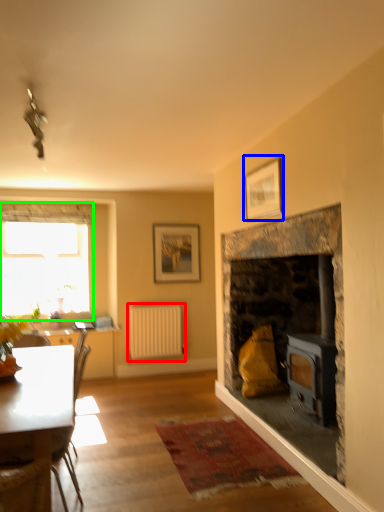
Question: Which is nearer to the radiator (highlighted by a red box)? picture frame (highlighted by a blue box) or window (highlighted by a green box).

Choices:
 (A) picture frame
 (B) window

Answer: (B)